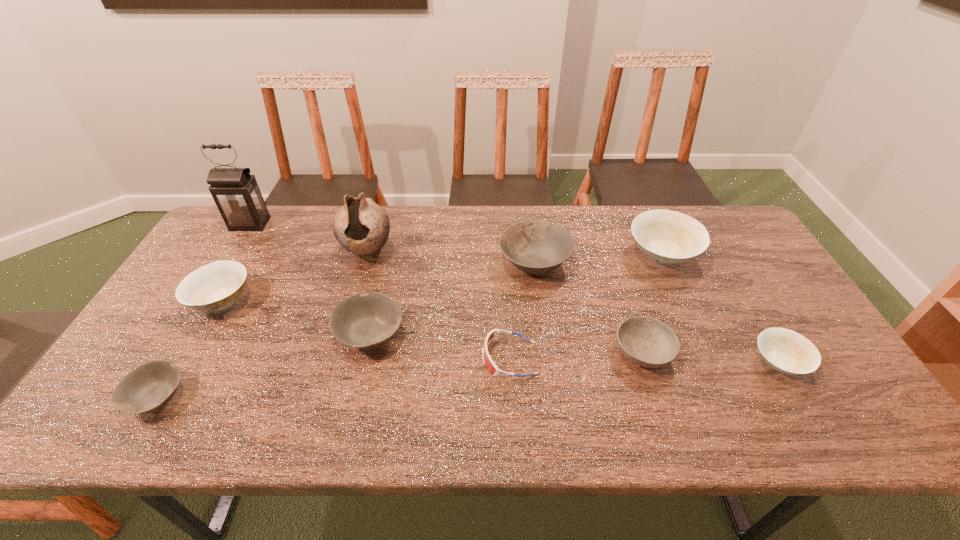
This screenshot has width=960, height=540. Find the location of `the tallest object`. the tallest object is located at coordinates (236, 193).

The height and width of the screenshot is (540, 960). What are the coordinates of `lantern` in the screenshot? It's located at (236, 193).

Find the location of `the second tallest object`. the second tallest object is located at coordinates (361, 226).

At what (x,y) coordinates should I click in order to perform the action: click on the biggest beige bowl. Please return your answer as a coordinate pair (x, y). Looking at the image, I should click on (668, 237).

Image resolution: width=960 pixels, height=540 pixels. I want to click on the farthest gray bowl, so click(536, 247).

The image size is (960, 540). Find the location of `the biggest gray bowl`. the biggest gray bowl is located at coordinates (536, 247).

Find the location of a particular element. the leftmost beige bowl is located at coordinates (216, 286).

Locate an element on the screen. the second gray bowl from right to left is located at coordinates (367, 319).

At what (x,y) coordinates should I click in order to perform the action: click on the fifth bowl from right to left. Please return your answer as a coordinate pair (x, y). The height and width of the screenshot is (540, 960). Looking at the image, I should click on (367, 319).

Where is `the nearest beige bowl`? The image size is (960, 540). the nearest beige bowl is located at coordinates (786, 351).